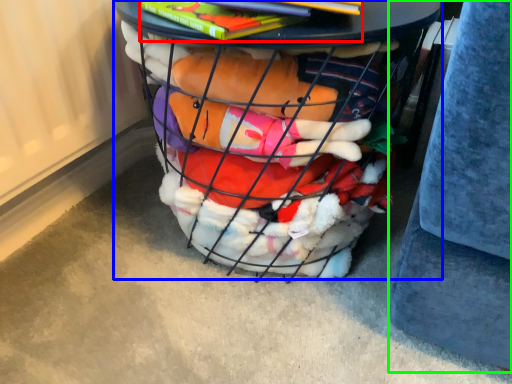
Question: Considering the real-world distances, which object is farthest from book (highlighted by a red box)? furniture (highlighted by a blue box) or gray (highlighted by a green box)?

Choices:
 (A) furniture
 (B) gray

Answer: (B)